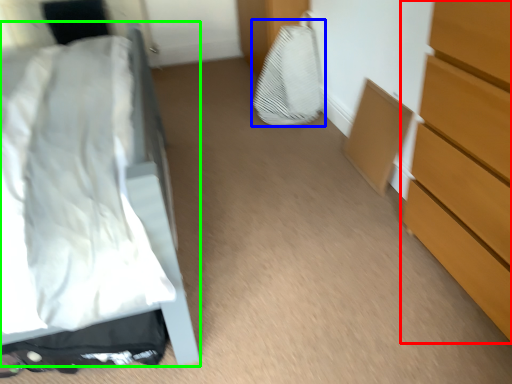
Question: Which object is positioned farthest from chest of drawers (highlighted by a red box)? Select from sheet (highlighted by a blue box) and bed (highlighted by a green box).

Choices:
 (A) sheet
 (B) bed

Answer: (A)